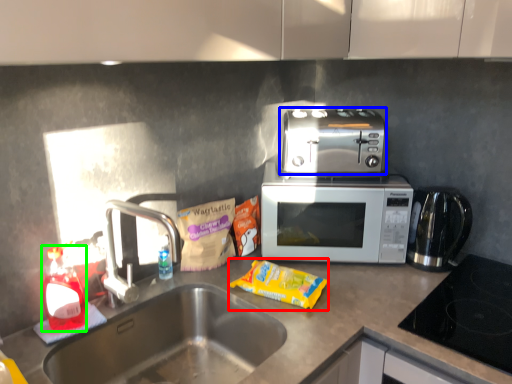
Question: Estimate the real-world distances between objects in this image. Which object is farther from snack (highlighted by a red box), toaster (highlighted by a blue box) or bottle (highlighted by a green box)?

Choices:
 (A) toaster
 (B) bottle

Answer: (B)